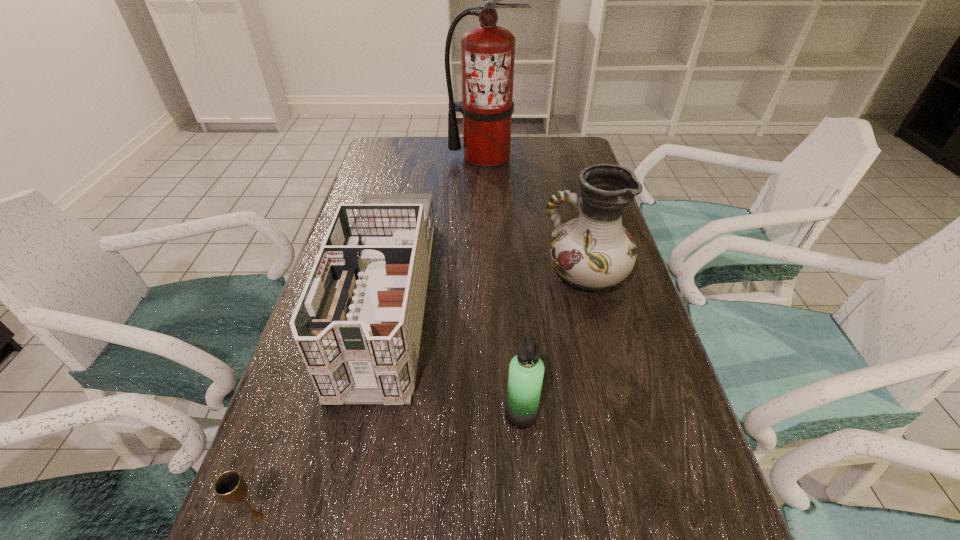
The width and height of the screenshot is (960, 540). Find the location of `vacant space at the far left corner of the desktop`. vacant space at the far left corner of the desktop is located at coordinates (381, 144).

You are a GUI agent. You are given a task and a screenshot of the screen. Output one action in this format:
    pyautogui.click(x=<x>, y=<y>)
    Task: Click on the vacant space at the far right corner
    The width and height of the screenshot is (960, 540).
    Given the screenshot: What is the action you would take?
    pyautogui.click(x=547, y=139)

This screenshot has width=960, height=540. Identify the location of free space between the dollhouse and the nearest object. point(323,408).

This screenshot has height=540, width=960. Identify the location of blank region between the fourth shortest object and the thermos bottle. (553, 346).

Locate an element on the screen. The height and width of the screenshot is (540, 960). unoccupied position between the rightmost object and the dollhouse is located at coordinates (486, 287).

I want to click on free point between the dollhouse and the chalice, so click(x=323, y=408).

Locate an element on the screen. vacant area between the farthest object and the thermos bottle is located at coordinates (503, 285).

I want to click on free space between the shortest object and the thermos bottle, so click(390, 466).

At what (x,y) coordinates should I click in order to perform the action: click on the closest object relative to the dollhouse. Please return your answer as a coordinate pair (x, y). The image size is (960, 540). Looking at the image, I should click on (231, 487).

The height and width of the screenshot is (540, 960). I want to click on the fourth closest object to the rightmost object, so click(x=231, y=487).